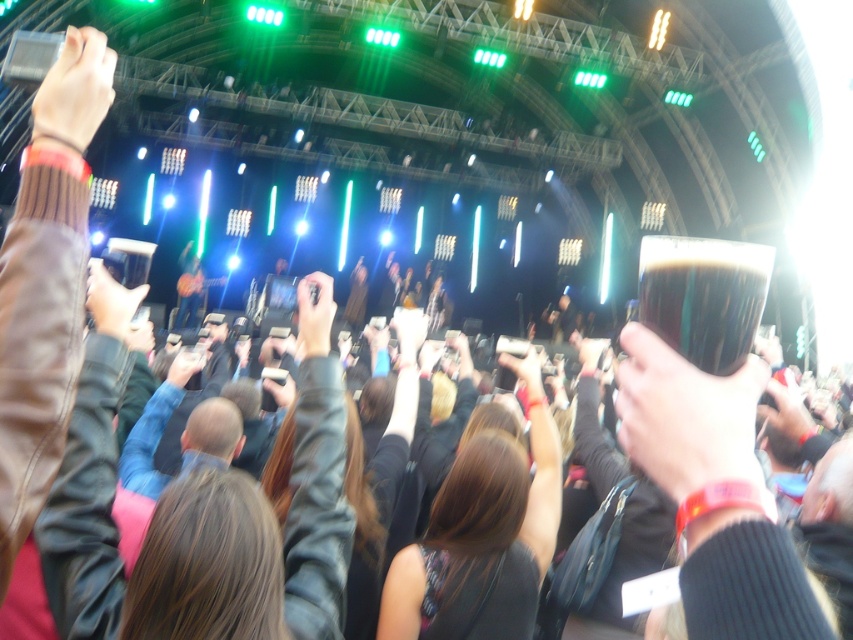
Who is higher up, brown leather jacket at center or dark glass beer at upper center?

Positioned higher is dark glass beer at upper center.

Is brown leather jacket at center bigger than dark glass beer at upper center?

Yes.

Is point (444, 515) behind point (712, 330)?

Yes, it is behind point (712, 330).

Where is `brown leather jacket at center`? brown leather jacket at center is located at coordinates (482, 532).